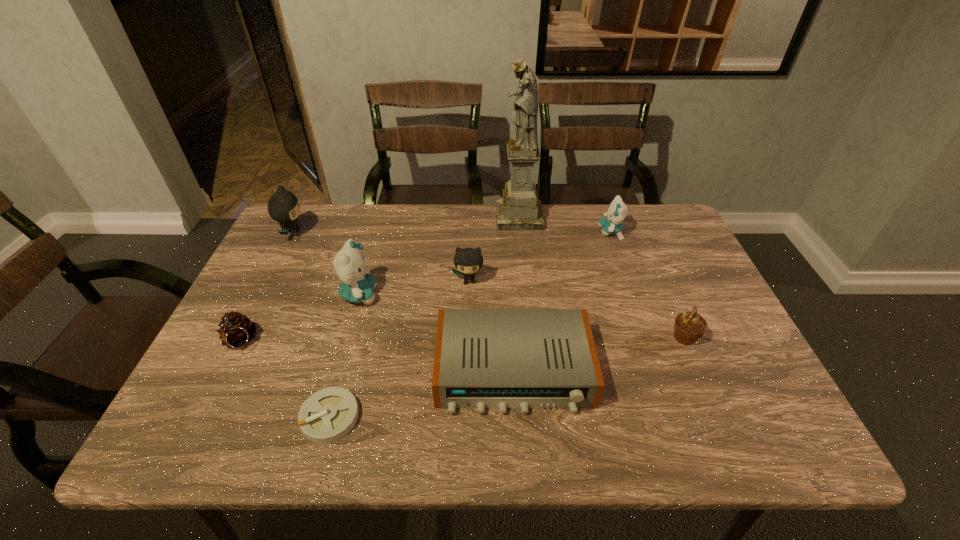
Find the location of a particular element. This screenshot has height=540, width=960. free space located 0.300m on the face of the smaller blue kitten is located at coordinates (501, 232).

This screenshot has width=960, height=540. I want to click on vacant space located 0.300m on the face of the smaller blue kitten, so click(x=501, y=232).

Where is `vacant space located 0.350m on the face of the smaller blue kitten`? The width and height of the screenshot is (960, 540). vacant space located 0.350m on the face of the smaller blue kitten is located at coordinates (485, 232).

In order to click on vacant space located on the front-facing side of the second kitten from right to left in this screenshot , I will do point(467,363).

Locate an element on the screen. free location located on the right of the muffin is located at coordinates (736, 338).

Locate an element on the screen. Image resolution: width=960 pixels, height=540 pixels. vacant area located with a leaf charm attached to the pinecone is located at coordinates (194, 433).

At what (x,y) coordinates should I click in order to perform the action: click on blank space located on the control panel of the radio receiver. Please return your answer as a coordinate pair (x, y). Looking at the image, I should click on (518, 449).

Find the location of a particular element. The height and width of the screenshot is (540, 960). vacant area situated 0.070m on the left of the shortest object is located at coordinates (268, 417).

You are a GUI agent. You are given a task and a screenshot of the screen. Output one action in this format:
    pyautogui.click(x=<x>, y=<y>)
    Task: Click on the sculpture situated at the far edge
    
    Given the screenshot: What is the action you would take?
    pyautogui.click(x=519, y=209)

Image resolution: width=960 pixels, height=540 pixels. What are the coordinates of `radio receiver that is at the near edge` in the screenshot? It's located at (502, 359).